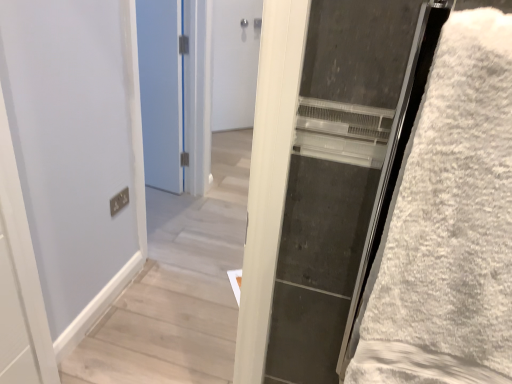
Question: Could you tell me if white fluffy bath towel at right is turned towards white matte door at center, which ranks as the first door in right-to-left order?

Choices:
 (A) yes
 (B) no

Answer: (B)

Question: Is white fluffy bath towel at right wider than white matte door at center, acting as the 2th door starting from the front?

Choices:
 (A) yes
 (B) no

Answer: (A)

Question: From the image's perspective, is white fluffy bath towel at right on white matte door at center, the first door when ordered from back to front?

Choices:
 (A) no
 (B) yes

Answer: (A)

Question: Can you confirm if white fluffy bath towel at right is bigger than white matte door at center, the first door when ordered from back to front?

Choices:
 (A) yes
 (B) no

Answer: (A)

Question: Is white fluffy bath towel at right facing away from white matte door at center, which ranks as the first door in right-to-left order?

Choices:
 (A) no
 (B) yes

Answer: (A)

Question: From the image's perspective, is white fluffy bath towel at right above or below blue painted door at upper left, the first door positioned from the front?

Choices:
 (A) above
 (B) below

Answer: (B)

Question: Considering the positions of white fluffy bath towel at right and blue painted door at upper left, the first door positioned from the front, in the image, is white fluffy bath towel at right wider or thinner than blue painted door at upper left, the first door positioned from the front,?

Choices:
 (A) thin
 (B) wide

Answer: (B)

Question: Is point (434, 82) positioned closer to the camera than point (158, 167)?

Choices:
 (A) closer
 (B) farther

Answer: (A)

Question: Would you say white fluffy bath towel at right is to the left or to the right of blue painted door at upper left, placed as the 2th door when sorted from back to front, in the picture?

Choices:
 (A) right
 (B) left

Answer: (A)

Question: Considering the positions of white fluffy bath towel at right and white matte door at center, acting as the 2th door starting from the front, in the image, is white fluffy bath towel at right wider or thinner than white matte door at center, acting as the 2th door starting from the front,?

Choices:
 (A) thin
 (B) wide

Answer: (B)

Question: From the image's perspective, is white fluffy bath towel at right located above or below white matte door at center, acting as the 2th door starting from the front?

Choices:
 (A) below
 (B) above

Answer: (A)

Question: Do you think white fluffy bath towel at right is within white matte door at center, the first door when ordered from back to front, or outside of it?

Choices:
 (A) inside
 (B) outside

Answer: (B)

Question: In the image, is white fluffy bath towel at right positioned in front of or behind white matte door at center, the first door when ordered from back to front?

Choices:
 (A) behind
 (B) front

Answer: (B)

Question: Based on their sizes in the image, would you say blue painted door at upper left, placed as the 2th door when sorted from back to front, is bigger or smaller than white matte door at center, the first door when ordered from back to front?

Choices:
 (A) big
 (B) small

Answer: (B)

Question: Considering the positions of blue painted door at upper left, the second door from the right, and white matte door at center, which appears as the second door when viewed from the left, in the image, is blue painted door at upper left, the second door from the right, wider or thinner than white matte door at center, which appears as the second door when viewed from the left,?

Choices:
 (A) thin
 (B) wide

Answer: (B)